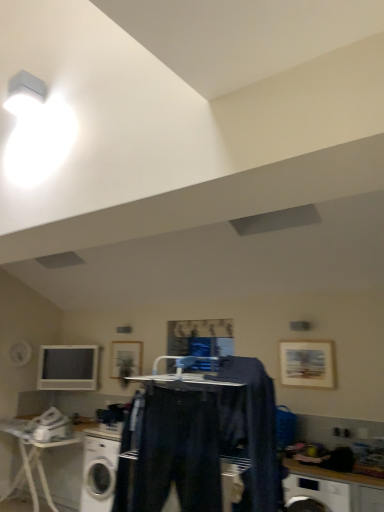
Question: Choose the correct answer: Is white glossy washing machine at lower left inside dark blue fabric at center, the second clothing from the left, or outside it?

Choices:
 (A) outside
 (B) inside

Answer: (A)

Question: Is white glossy washing machine at lower left to the left or to the right of dark blue fabric at center, the second clothing from the left, in the image?

Choices:
 (A) left
 (B) right

Answer: (A)

Question: Which object is the closest to the denim pants at center, arranged as the 2th clothing when viewed from the right?

Choices:
 (A) white glossy computer monitor at left
 (B) wooden countertop at lower right
 (C) white plastic iron at lower left
 (D) white glossy washing machine at lower left
 (E) dark blue fabric at center, the second clothing from the left

Answer: (E)

Question: Which of these objects is positioned closest to the dark blue fabric at center, the first clothing positioned from the right?

Choices:
 (A) white glossy washing machine at lower left
 (B) wooden countertop at lower right
 (C) wooden framed artwork at upper right, which is the first picture frame from front to back
 (D) wooden framed picture at center, the 1th picture frame from the back
 (E) white plastic iron at lower left

Answer: (A)